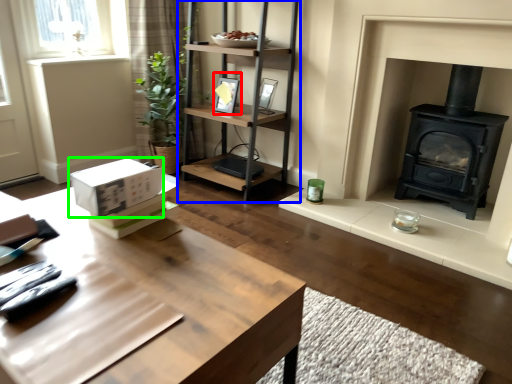
Question: Considering the real-world distances, which object is farthest from picture frame (highlighted by a red box)? shelf (highlighted by a blue box) or cardboard box (highlighted by a green box)?

Choices:
 (A) shelf
 (B) cardboard box

Answer: (B)